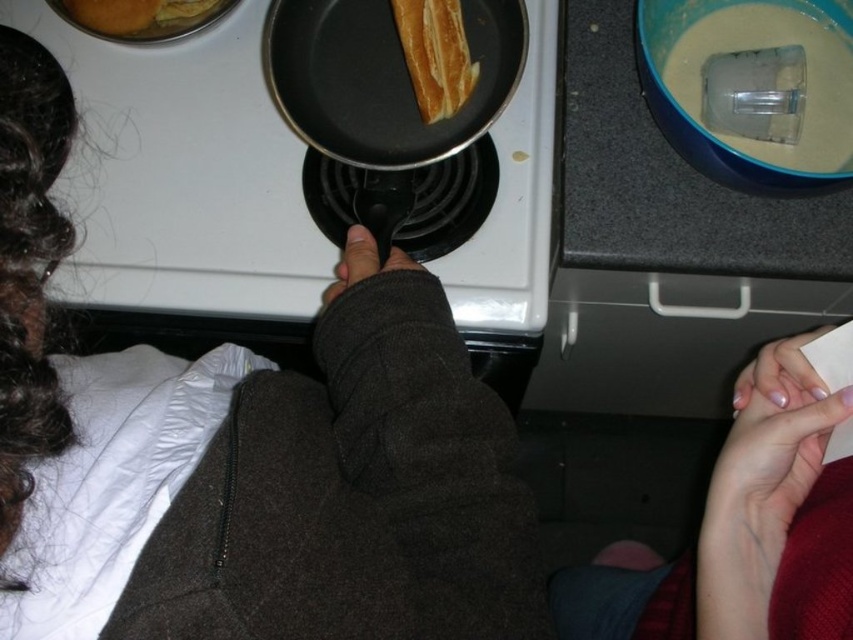
Question: Which point is closer to the camera?

Choices:
 (A) (405, 108)
 (B) (822, 80)
 (C) (416, 1)
 (D) (85, 232)

Answer: (C)

Question: Is black non-stick frying pan at center further to the viewer compared to golden matte bread at center?

Choices:
 (A) no
 (B) yes

Answer: (A)

Question: Which object is closer to the camera taking this photo?

Choices:
 (A) black non-stick frying pan at center
 (B) clear plastic container at upper right
 (C) golden matte bread at center
 (D) black matte pan at center

Answer: (A)

Question: Considering the real-world distances, which object is closest to the golden matte bread at center?

Choices:
 (A) clear plastic container at upper right
 (B) black non-stick frying pan at center

Answer: (B)

Question: Is clear plastic container at upper right above golden matte bread at center?

Choices:
 (A) yes
 (B) no

Answer: (B)

Question: Observing the image, what is the correct spatial positioning of black matte pan at center in reference to golden matte bread at center?

Choices:
 (A) right
 (B) left

Answer: (B)